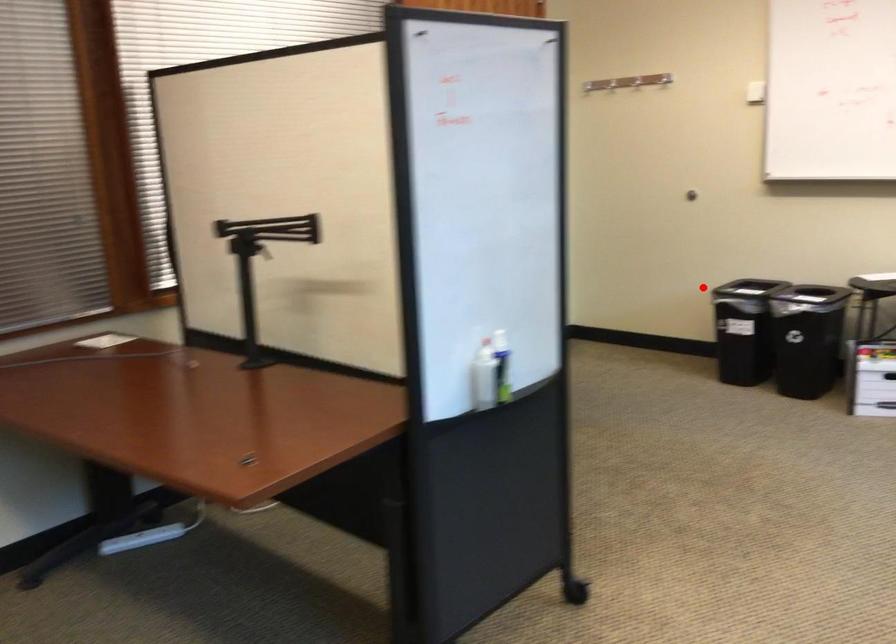
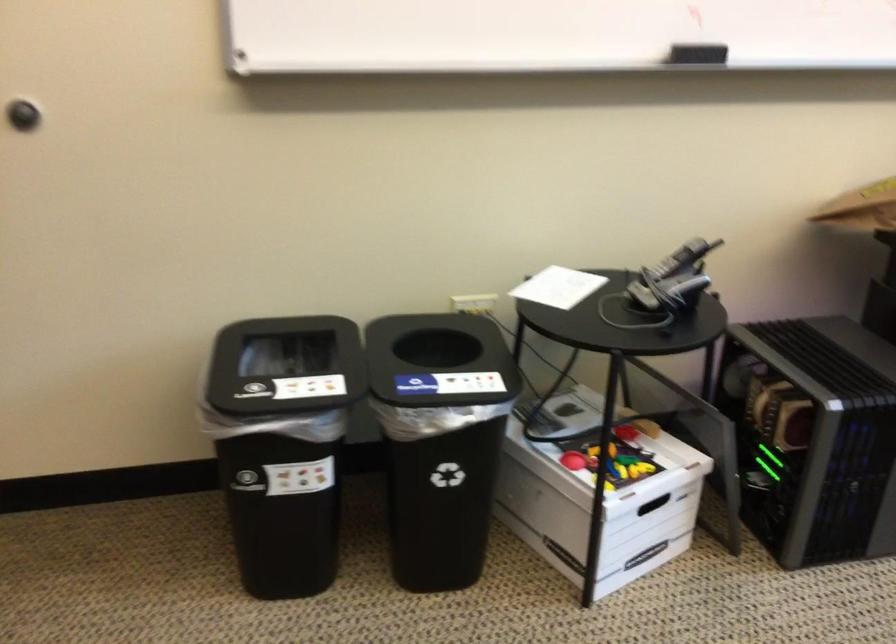
In the second image, find the point that corresponds to the highlighted location in the first image.

(286, 366)